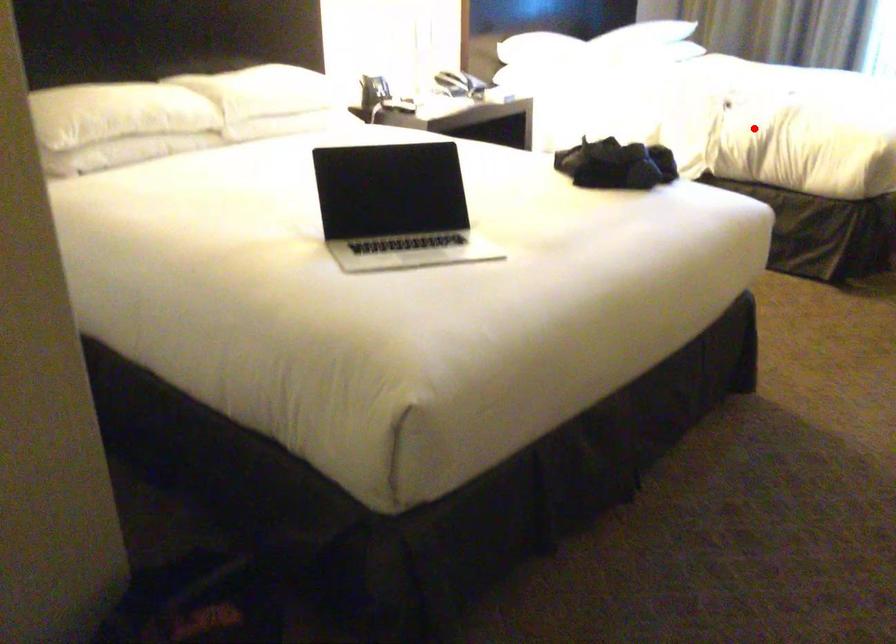
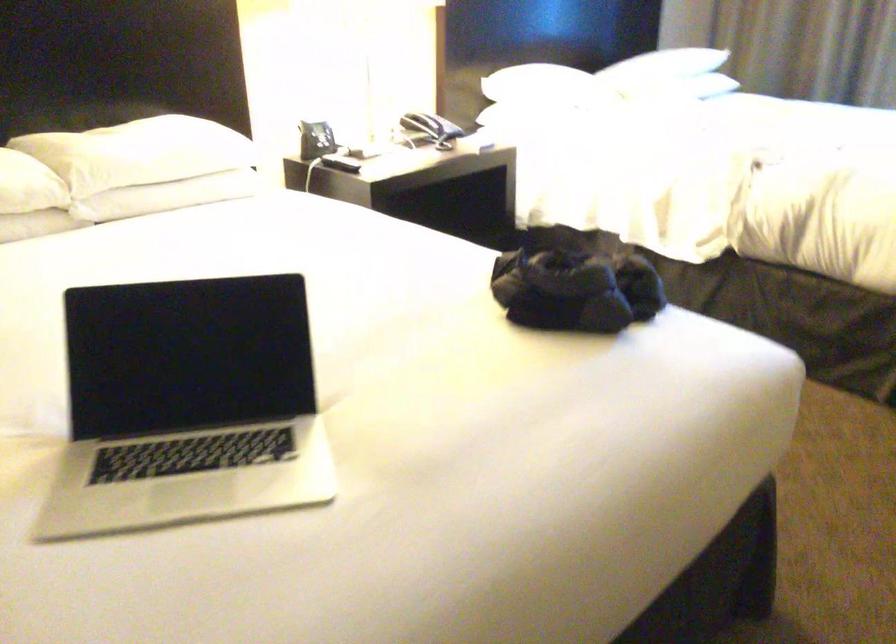
Question: I am providing you with two images of the same scene from different viewpoints. Given a red point in image1, look at the same physical point in image2. Is it:

Choices:
 (A) Closer to the viewpoint
 (B) Farther from the viewpoint

Answer: (A)